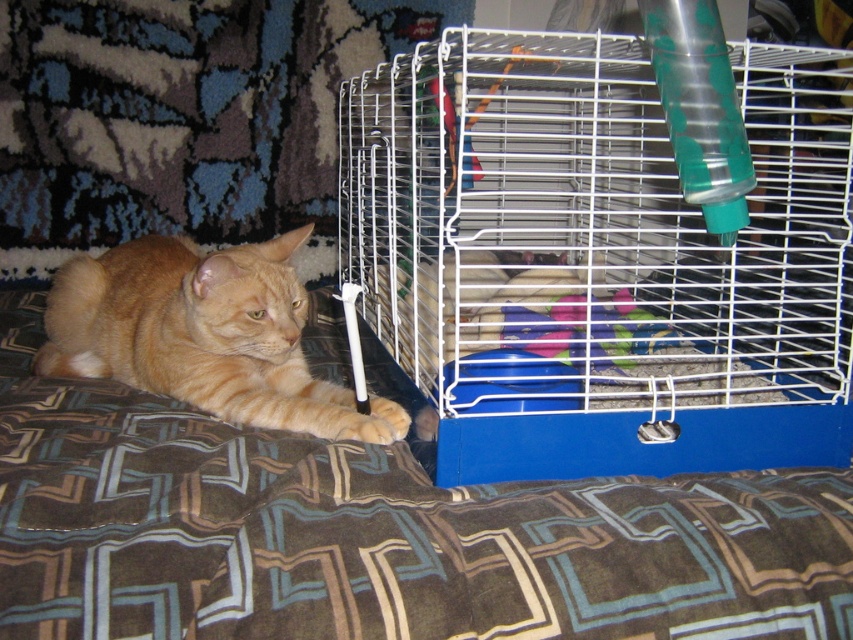
Question: Which object is closer to the camera taking this photo?

Choices:
 (A) white wire birdcage at center
 (B) brown fabric bed at lower left

Answer: (B)

Question: Which object is positioned closest to the brown fabric bed at lower left?

Choices:
 (A) orange fur cat at left
 (B) white wire birdcage at center

Answer: (A)

Question: In this image, where is white wire birdcage at center located relative to orange fur cat at left?

Choices:
 (A) right
 (B) left

Answer: (A)

Question: Among these points, which one is farthest from the camera?

Choices:
 (A) (721, 632)
 (B) (399, 358)
 (C) (325, 416)

Answer: (B)

Question: In this image, where is white wire birdcage at center located relative to orange fur cat at left?

Choices:
 (A) right
 (B) left

Answer: (A)

Question: Observing the image, what is the correct spatial positioning of brown fabric bed at lower left in reference to orange fur cat at left?

Choices:
 (A) right
 (B) left

Answer: (A)